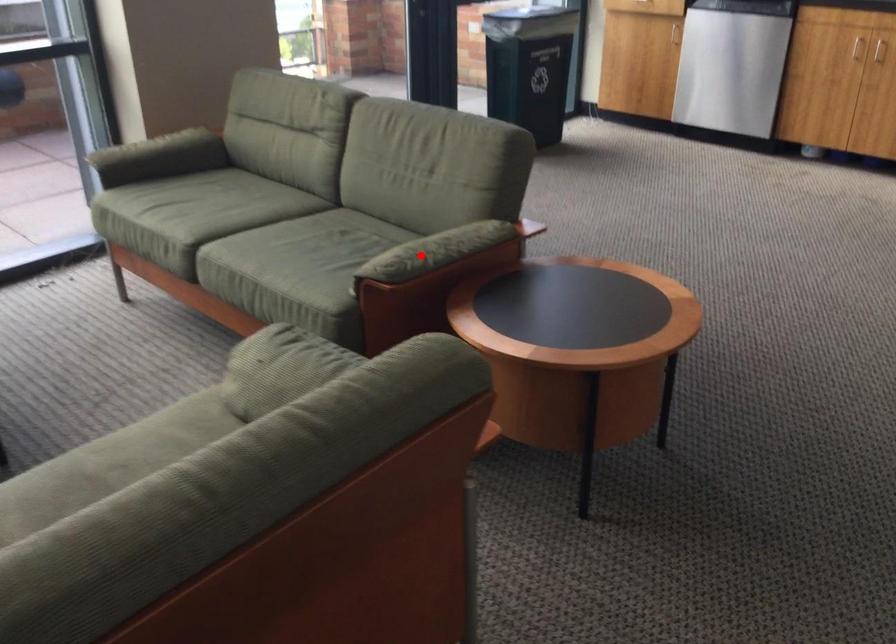
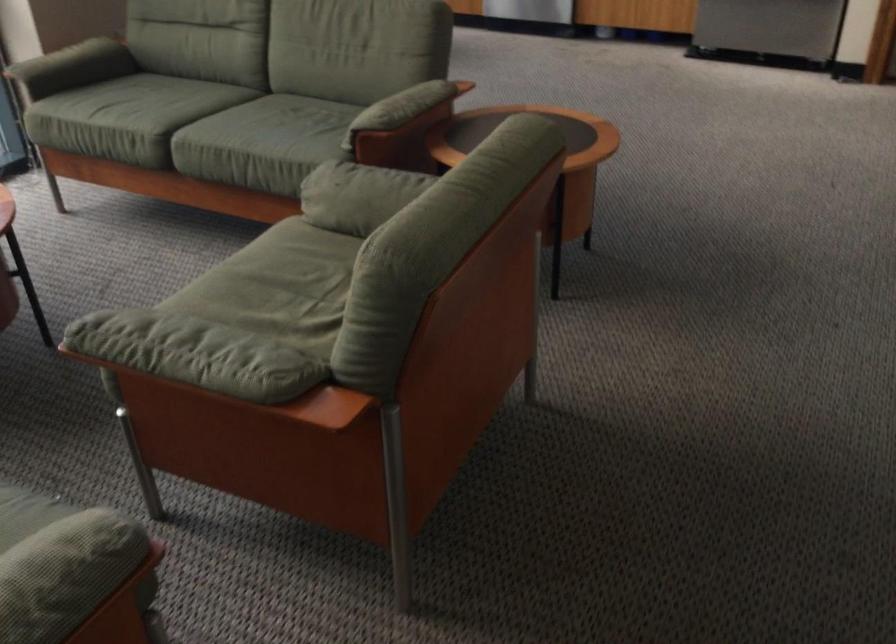
In the second image, find the point that corresponds to the highlighted location in the first image.

(398, 109)